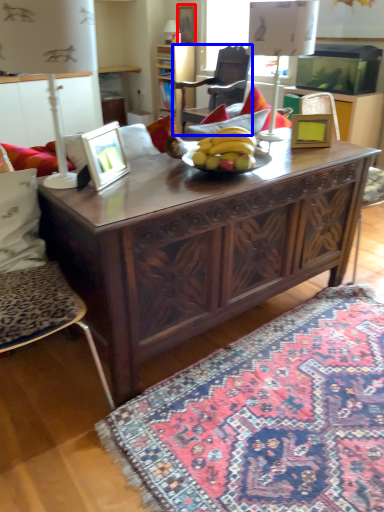
Question: Which of the following is the closest to the observer, picture frame (highlighted by a red box) or chair (highlighted by a blue box)?

Choices:
 (A) picture frame
 (B) chair

Answer: (B)